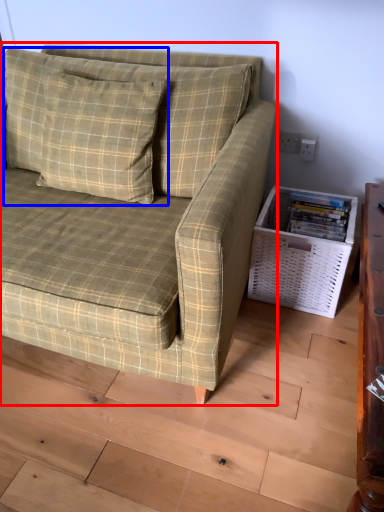
Question: Among these objects, which one is farthest to the camera, studio couch (highlighted by a red box) or pillow (highlighted by a blue box)?

Choices:
 (A) studio couch
 (B) pillow

Answer: (B)